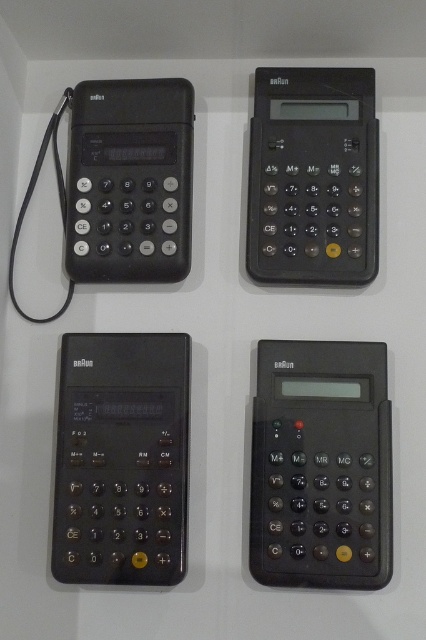
Identify the location of black plastic calculator at lower left. [x=121, y=460].

Measure the distance between point (187, 339) and camera.

3.40 feet

Describe the element at coordinates (121, 460) in the screenshot. Image resolution: width=426 pixels, height=640 pixels. I see `black plastic calculator at lower left` at that location.

Image resolution: width=426 pixels, height=640 pixels. I want to click on black plastic calculator at lower left, so click(121, 460).

Does black plastic calculator at lower left have a lesser width compared to black plastic calculator at upper right?

Indeed, black plastic calculator at lower left has a lesser width compared to black plastic calculator at upper right.

Who is taller, black plastic calculator at lower left or black plastic calculator at upper right?

With more height is black plastic calculator at lower left.

The height and width of the screenshot is (640, 426). Describe the element at coordinates (121, 460) in the screenshot. I see `black plastic calculator at lower left` at that location.

The width and height of the screenshot is (426, 640). Find the location of `black plastic calculator at lower left`. black plastic calculator at lower left is located at coordinates (121, 460).

Which is behind, point (302, 557) or point (86, 349)?

Positioned behind is point (86, 349).

Between point (275, 465) and point (163, 468), which one is positioned in front?

Point (275, 465)

Is point (328, 371) more distant than point (54, 531)?

Yes.

I want to click on black plastic calculator at bottom right, so pyautogui.click(x=321, y=465).